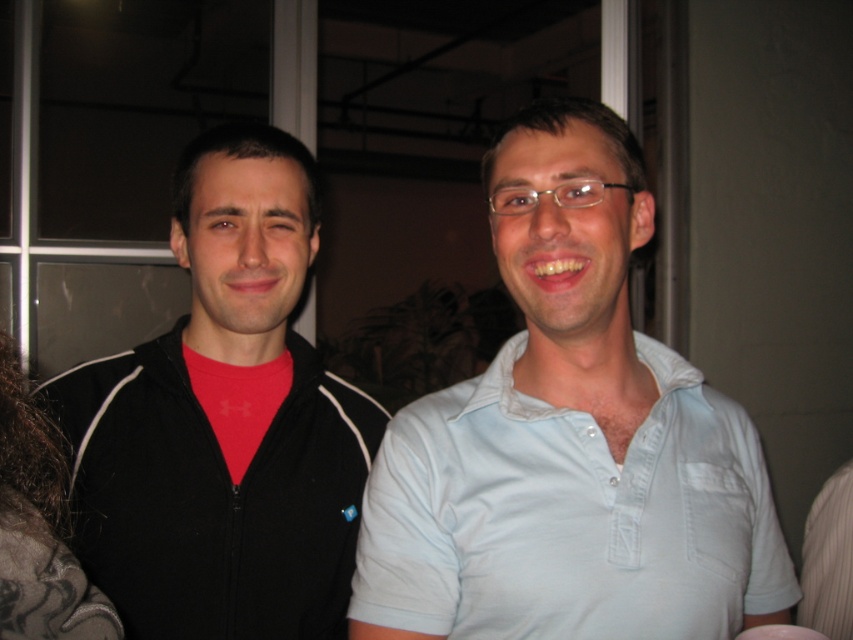
You are a photographer setting up for a group photo. You need to ensure that the light blue cotton polo shirt at center and the dark brown hair at left are both visible in the frame. Given their widths, which object should you adjust the camera angle to prioritize capturing first?

The light blue cotton polo shirt at center has a greater width than the dark brown hair at left, so you should prioritize adjusting the camera angle to ensure the light blue cotton polo shirt at center is fully captured first before focusing on the dark brown hair at left.

You are a photographer setting up for a group photo. You notice the black matte jacket at left and the dark brown hair at left. Which object should you adjust to ensure both are fully visible in the frame?

The black matte jacket at left is taller than dark brown hair at left. To ensure both are fully visible, you should adjust the camera angle or framing to account for the height difference, focusing on including the taller black matte jacket at left without cropping the dark brown hair at left.

You are a photographer trying to capture a clear photo of the light blue cotton polo shirt at center. However, the black matte jacket at left is blocking your view. Can you move around to the right side of the subjects to get an unobstructed shot?

The black matte jacket at left is further to the viewer than the light blue cotton polo shirt at center, so moving to the right side might still allow you to see the light blue cotton polo shirt at center as the jacket is closer and may still block the view depending on their positioning. However, adjusting your angle slightly to the right could help if there is space between them.